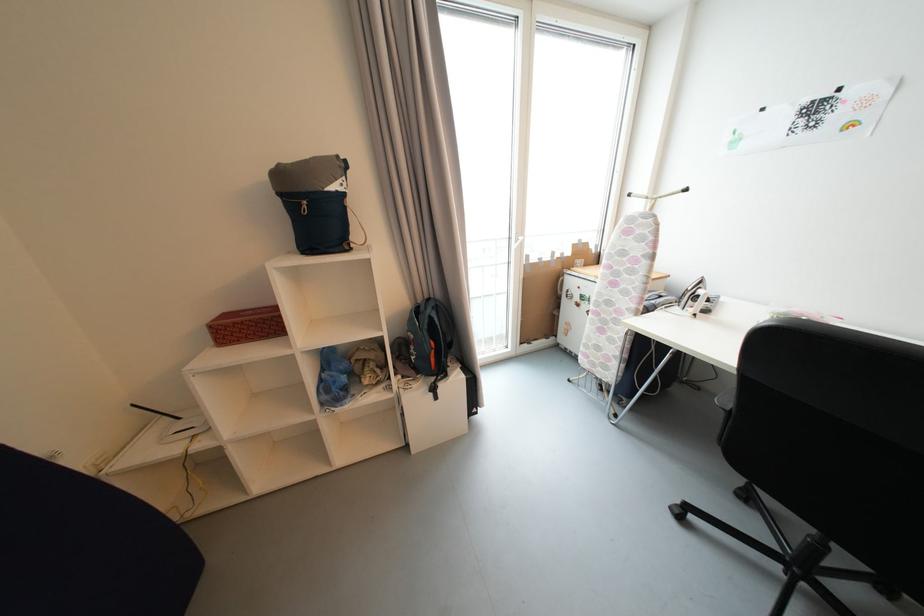
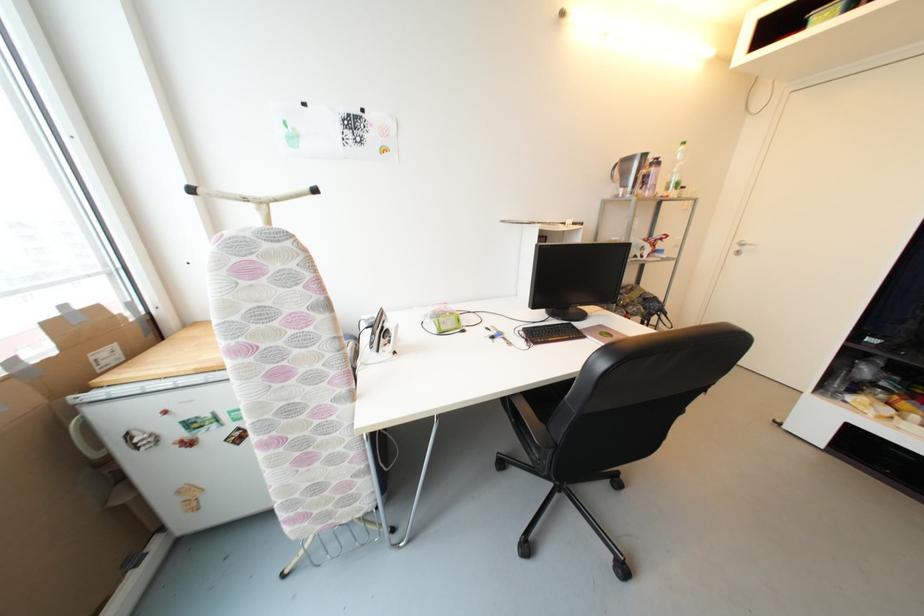
Where in the second image is the point corresponding to pixel 635 197 from the first image?

(197, 192)